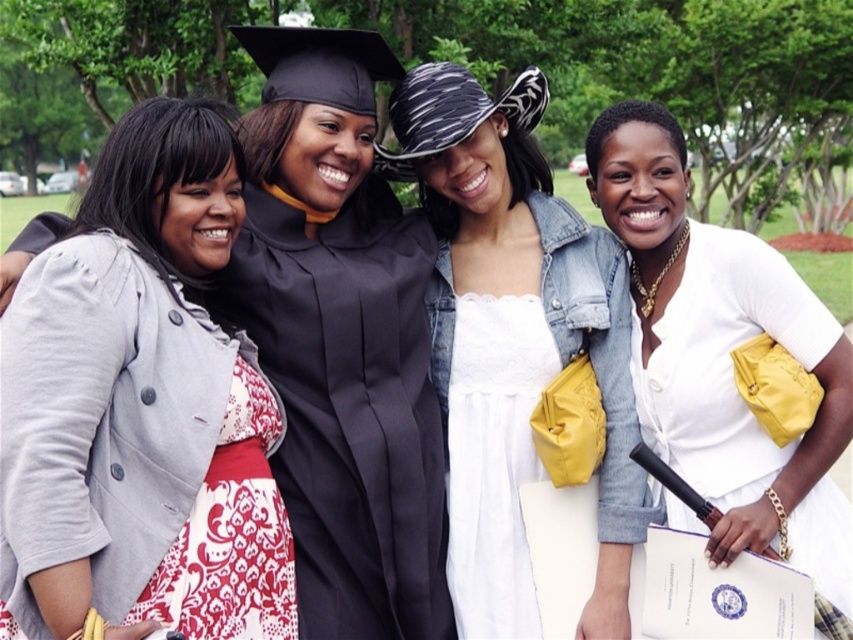
Question: Is white matte dress at center closer to the viewer compared to white lace dress at center?

Choices:
 (A) no
 (B) yes

Answer: (B)

Question: Does matte gray coat at left have a larger size compared to matte black gown at center?

Choices:
 (A) yes
 (B) no

Answer: (B)

Question: Which of the following is the closest to the observer?

Choices:
 (A) (679, 292)
 (B) (531, 250)

Answer: (A)

Question: Which object is positioned closest to the white matte dress at center?

Choices:
 (A) matte gray coat at left
 (B) matte black gown at center

Answer: (B)

Question: Is white lace dress at center closer to camera compared to white damask fabric dress at lower left?

Choices:
 (A) no
 (B) yes

Answer: (A)

Question: Considering the real-world distances, which object is farthest from the matte black gown at center?

Choices:
 (A) white damask fabric dress at lower left
 (B) white satin dress at center
 (C) matte gray coat at left
 (D) white lace dress at center

Answer: (C)